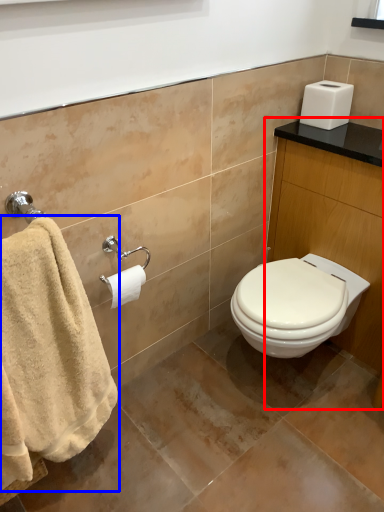
Question: Which of the following is the farthest to the observer, vanity (highlighted by a red box) or towel (highlighted by a blue box)?

Choices:
 (A) vanity
 (B) towel

Answer: (A)